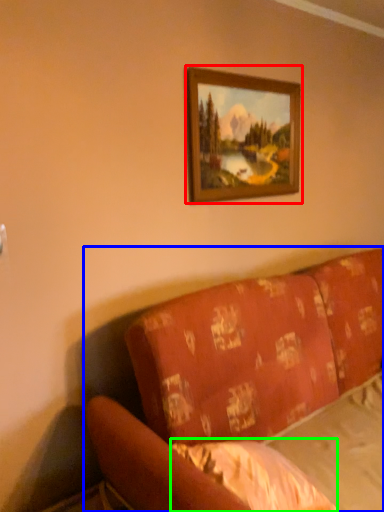
Question: Which object is the farthest from picture frame (highlighted by a red box)? Choose among these: studio couch (highlighted by a blue box) or sheet (highlighted by a green box).

Choices:
 (A) studio couch
 (B) sheet

Answer: (B)